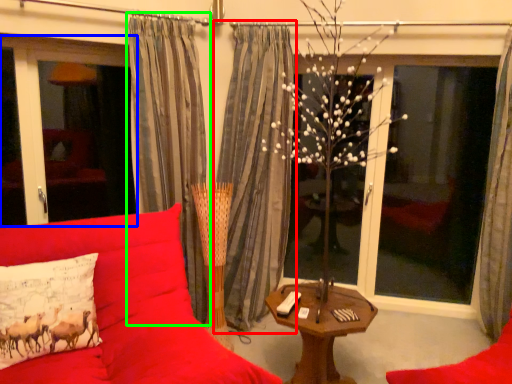
Question: Which object is positioned farthest from curtain (highlighted by a red box)? Select from window screen (highlighted by a blue box) and curtain (highlighted by a green box).

Choices:
 (A) window screen
 (B) curtain

Answer: (A)